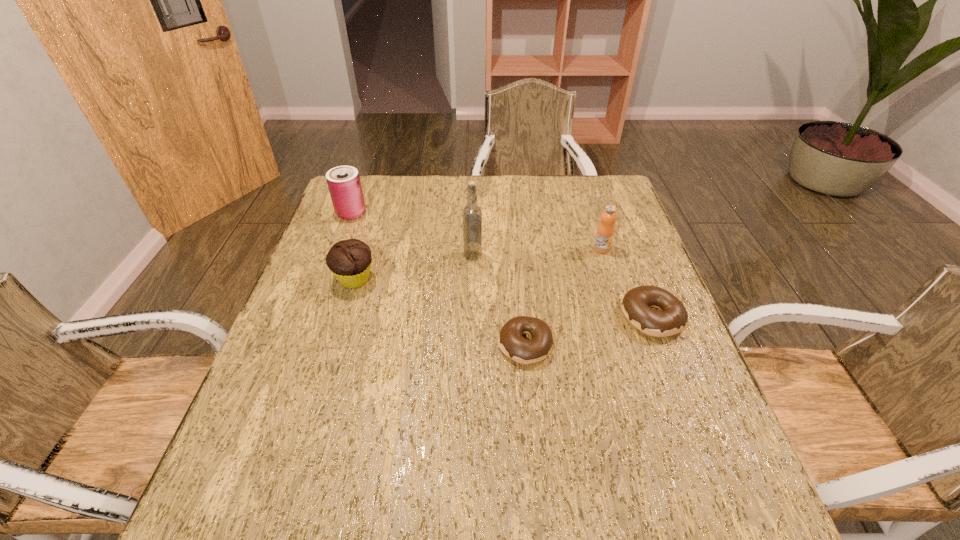
Please point a free position for a doughnut on the left. Please provide its 2D coordinates. Your answer should be formatted as a tuple, i.e. [(x, y)], where the tuple contains the x and y coordinates of a point satisfying the conditions above.

[(381, 375)]